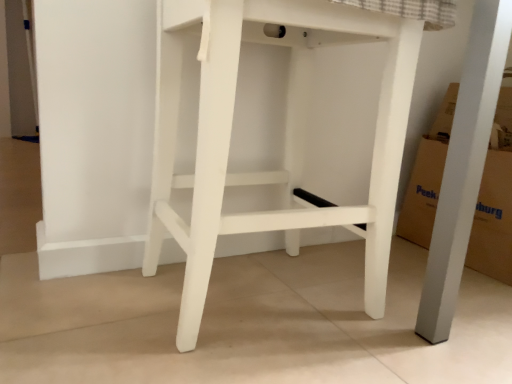
Question: Choose the correct answer: Is cardboard at right inside white matte stool at center or outside it?

Choices:
 (A) outside
 (B) inside

Answer: (A)

Question: From a real-world perspective, relative to white matte stool at center, is cardboard at right vertically above or below?

Choices:
 (A) below
 (B) above

Answer: (A)

Question: In terms of width, does cardboard at right look wider or thinner when compared to white matte stool at center?

Choices:
 (A) wide
 (B) thin

Answer: (B)

Question: From the image's perspective, relative to cardboard at right, is white matte stool at center above or below?

Choices:
 (A) above
 (B) below

Answer: (A)

Question: Considering the positions of white matte stool at center and cardboard at right in the image, is white matte stool at center wider or thinner than cardboard at right?

Choices:
 (A) thin
 (B) wide

Answer: (B)

Question: Based on their sizes in the image, would you say white matte stool at center is bigger or smaller than cardboard at right?

Choices:
 (A) small
 (B) big

Answer: (B)

Question: From a real-world perspective, is white matte stool at center physically located above or below cardboard at right?

Choices:
 (A) above
 (B) below

Answer: (A)